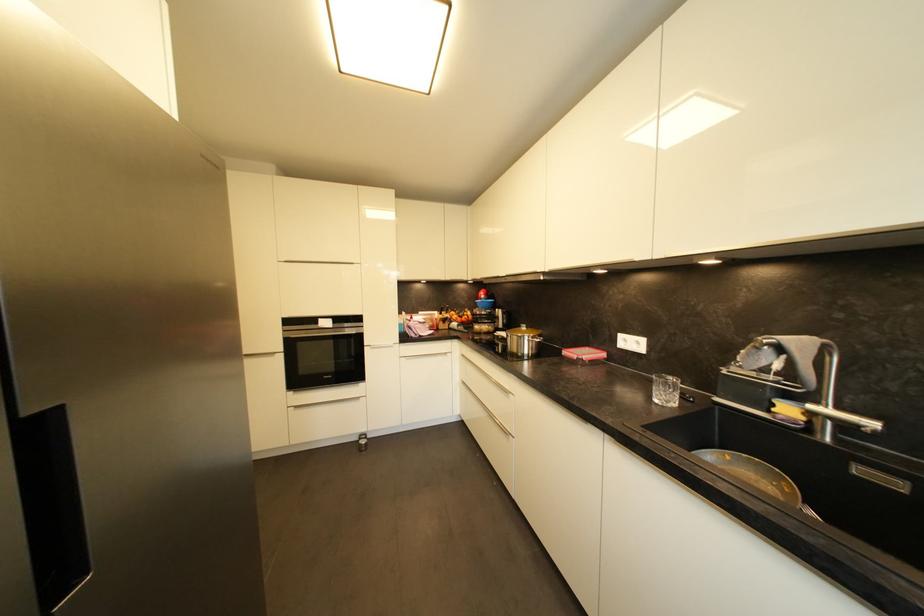
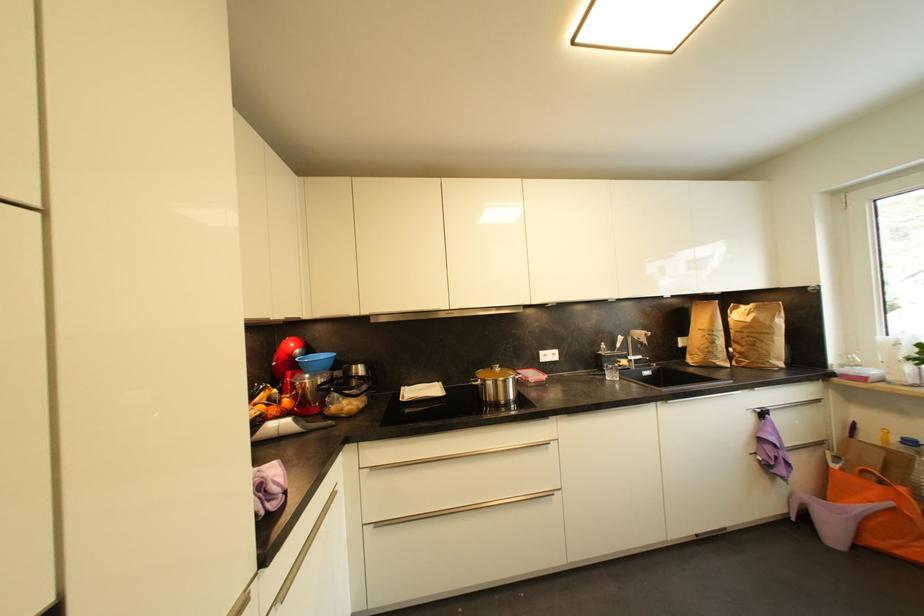
The point at (x=485, y=301) is marked in the first image. Where is the corresponding point in the second image?

(297, 359)